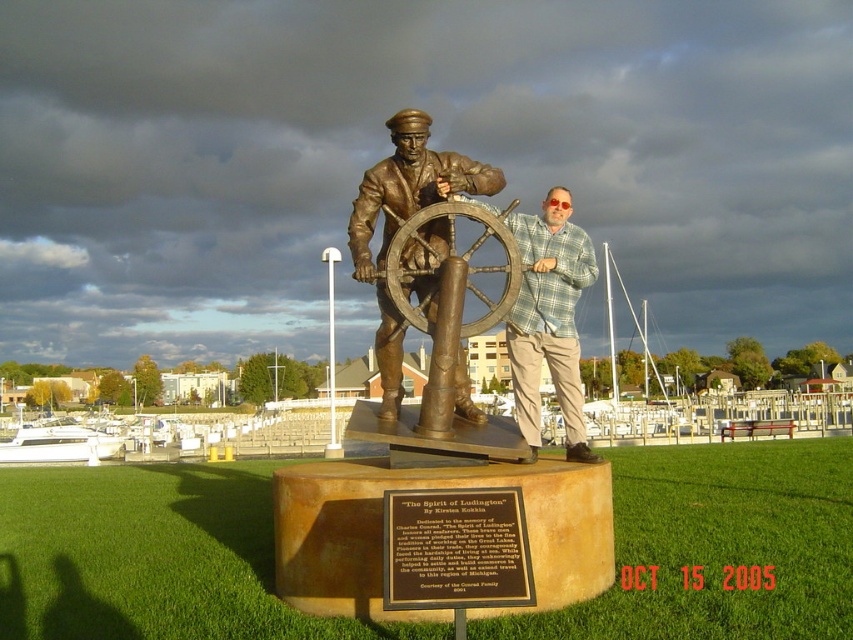
Can you confirm if plaid shirt at center is smaller than bronze/brass ship's wheel at center?

Incorrect, plaid shirt at center is not smaller in size than bronze/brass ship's wheel at center.

Between point (587, 260) and point (512, 236), which one is positioned in front?

Point (512, 236)

This screenshot has height=640, width=853. What do you see at coordinates (549, 320) in the screenshot?
I see `plaid shirt at center` at bounding box center [549, 320].

Where is `plaid shirt at center`? plaid shirt at center is located at coordinates (549, 320).

Who is higher up, bronze statue at center or bronze plaque at center?

bronze statue at center is higher up.

Does bronze statue at center have a lesser width compared to bronze plaque at center?

Yes.

Who is more forward, (296, 608) or (467, 573)?

Point (467, 573) is in front.

This screenshot has width=853, height=640. I want to click on bronze statue at center, so click(x=433, y=420).

Which is in front, point (517, 589) or point (405, 232)?

Point (517, 589)

How distant is bronze plaque at center from bronze/brass ship's wheel at center?

They are 2.59 meters apart.

Does point (496, 532) lie in front of point (427, 246)?

Yes, point (496, 532) is in front of point (427, 246).

The height and width of the screenshot is (640, 853). I want to click on bronze plaque at center, so click(x=456, y=548).